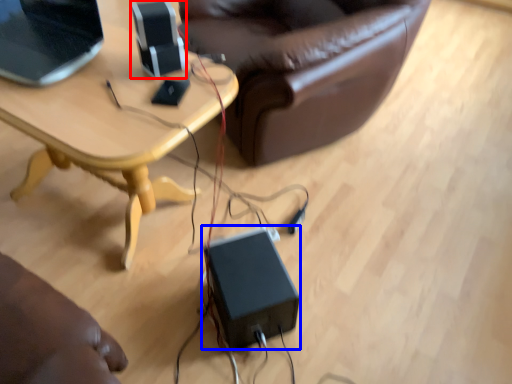
Question: Which object appears closest to the camera in this image, speaker (highlighted by a red box) or speaker (highlighted by a blue box)?

Choices:
 (A) speaker
 (B) speaker

Answer: (A)